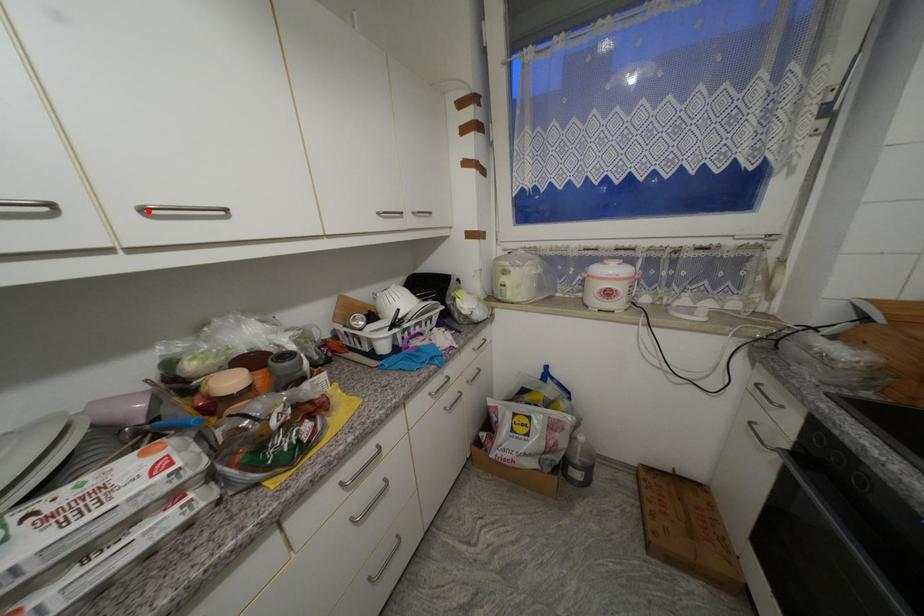
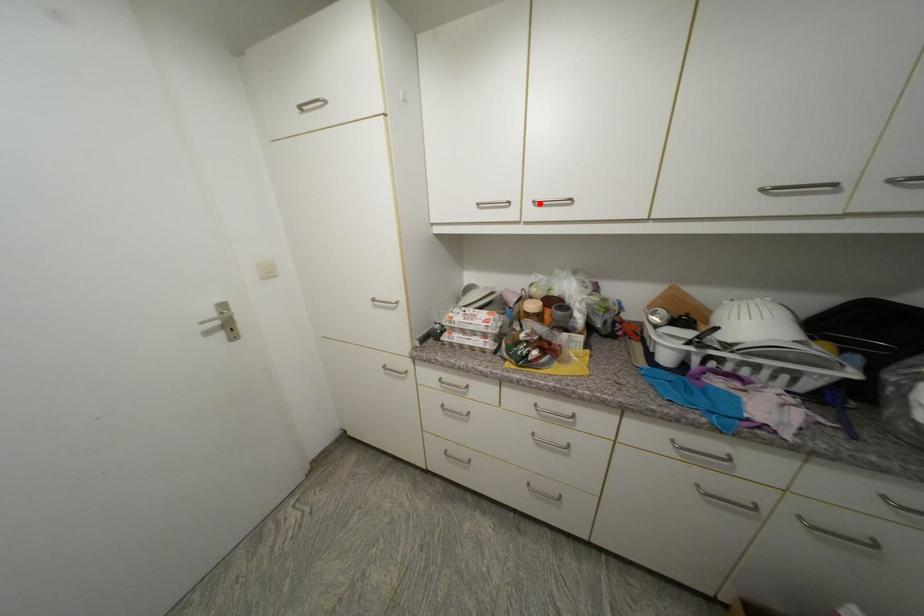
I am providing you with two images of the same scene from different viewpoints. A red point is marked on the first image and another point is marked on the second image. Does the point marked in image1 correspond to the same location as the one in image2?

Yes